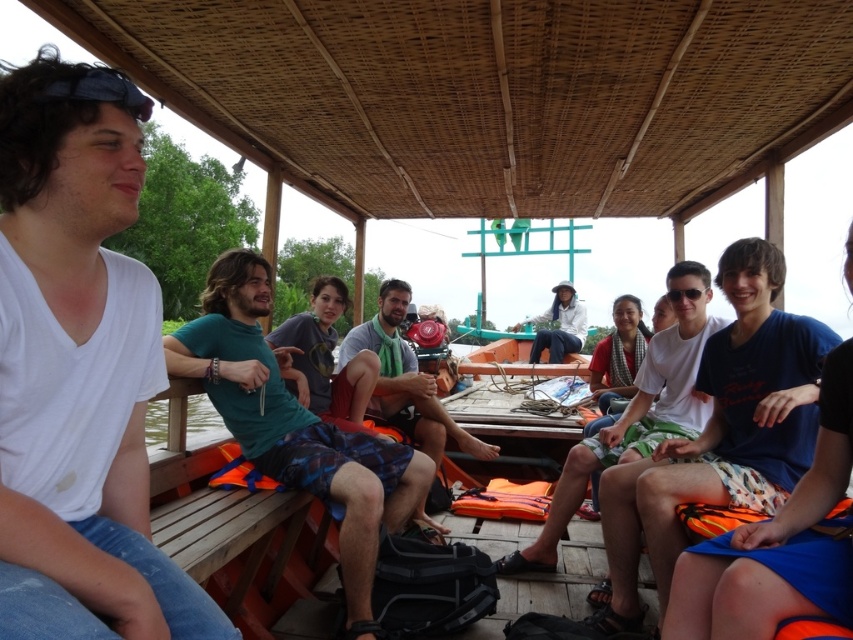
You are a photographer trying to capture a candid shot of the group on the boat. You notice the green fabric shorts at center and the white cotton shirt at center. Which clothing item takes up more horizontal space in the photo?

The green fabric shorts at center takes up more horizontal space than the white cotton shirt at center because its width surpasses the shirt.

You are a photographer on the boat and want to take a photo of the green fabric shorts at center and the white cotton shirt at center. Based on their positions, which one will appear closer to the camera in the photo?

The green fabric shorts at center appears closer to the camera because it is positioned in front of the white cotton shirt at center.

You are planning to wear the blue cotton shorts at center and the white fabric shirt at center for a warm day. Based on the image, which clothing item is narrower?

The blue cotton shorts at center is narrower than the white fabric shirt at center according to the description.